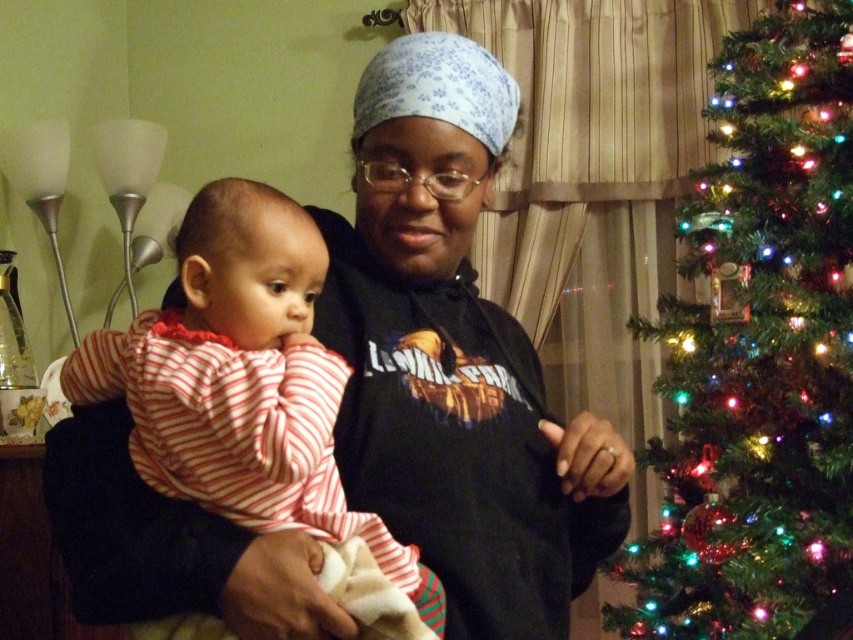
Based on the photo, you are organizing a photo shoot and want to ensure that the black matte hoodie at center and the iridescent plastic tree at right are both visible in the frame. Considering their sizes, which object should you prioritize positioning closer to the camera to maintain their visibility?

The black matte hoodie at center is smaller than the iridescent plastic tree at right. To maintain visibility, prioritize positioning the smaller black matte hoodie at center closer to the camera so it appears larger in the frame, balancing its size with the larger tree in the background.

You are a photographer trying to capture a photo of the black matte hoodie at center and the iridescent plastic tree at right. Based on their heights, which object should you focus on first if you want to ensure both are in frame without needing to adjust your camera angle?

The black matte hoodie at center has a lesser height compared to the iridescent plastic tree at right. Therefore, you should focus on the iridescent plastic tree at right first, as it is taller and will require framing from the bottom up to include the entire object while keeping the black matte hoodie at center in the same shot.

You are a photographer standing in front of the black matte hoodie at center and the iridescent plastic tree at right. You want to take a photo of the tree but need to ensure the hoodie doesn t block the view. Can you position yourself to the left or right of the hoodie to achieve this?

The black matte hoodie at center is positioned on the left side of the iridescent plastic tree at right. To avoid blocking the view of the tree, you should position yourself to the right of the black matte hoodie at center so that the tree is visible to the right side of the hoodie.